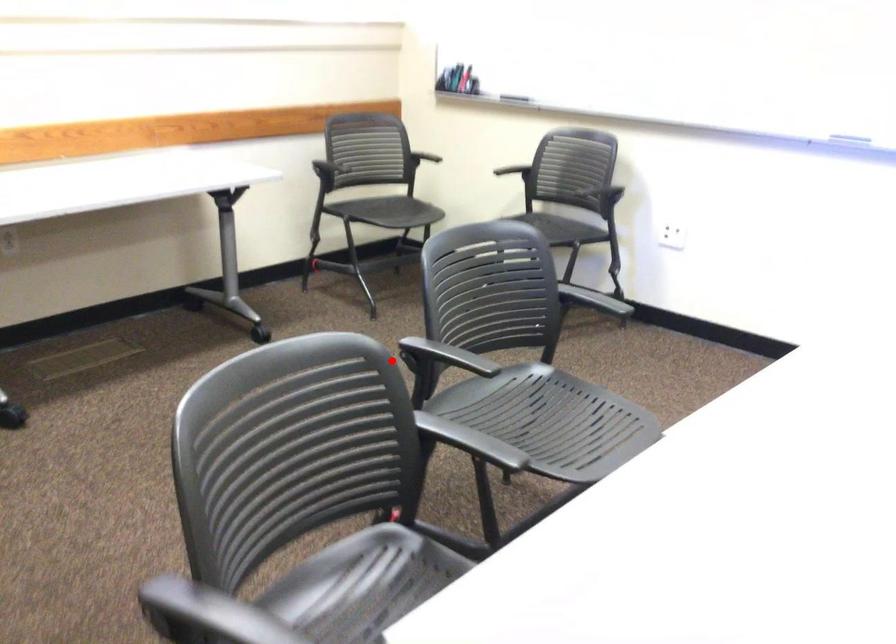
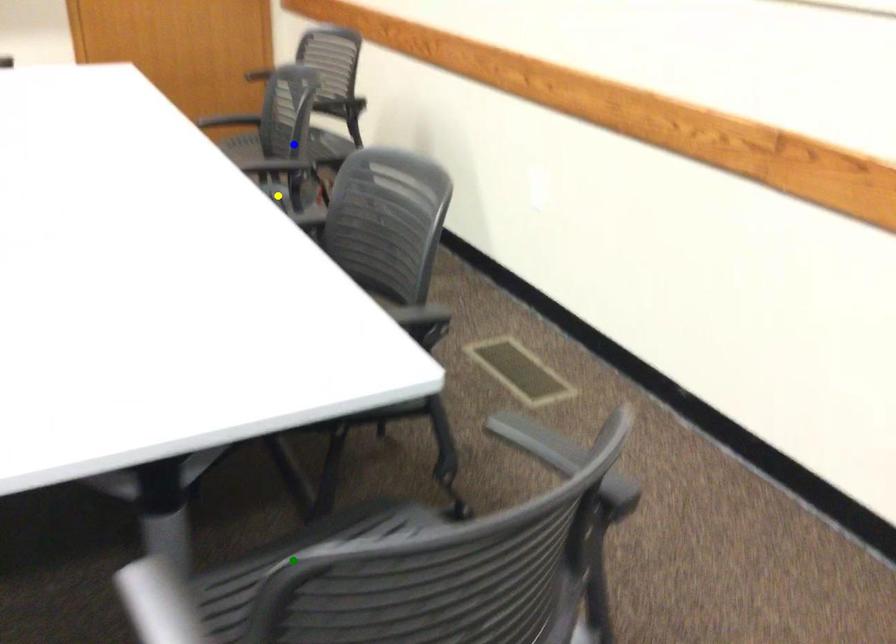
Question: I am providing you with two images of the same scene from different viewpoints. A red point is marked on the first image. You are given multiple points on the second image. Which spot in image 2 lines up with the point in image 1?

Choices:
 (A) yellow point
 (B) blue point
 (C) green point

Answer: (C)